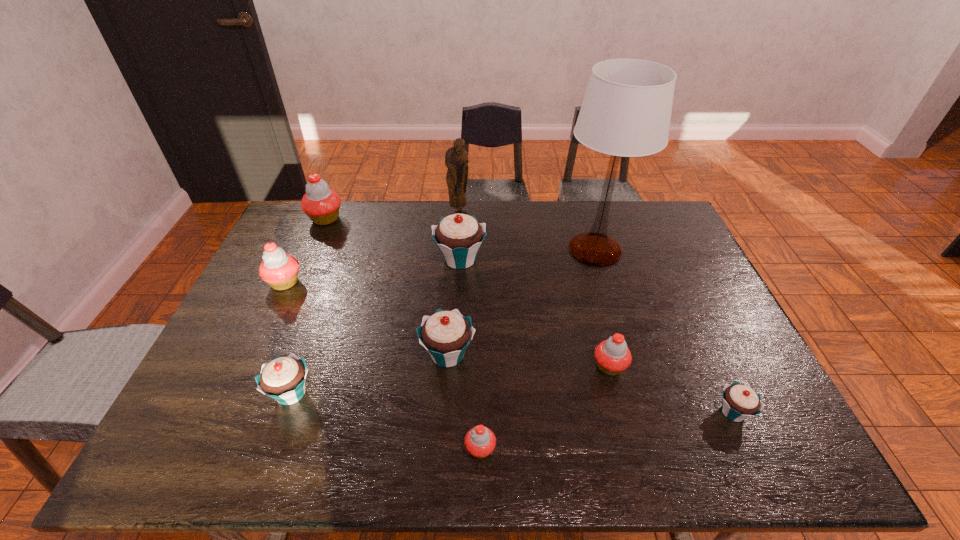
You are a GUI agent. You are given a task and a screenshot of the screen. Output one action in this format:
    pyautogui.click(x=<x>, y=<y>)
    Task: Click on the table lamp
    
    Given the screenshot: What is the action you would take?
    pyautogui.click(x=626, y=111)

This screenshot has height=540, width=960. I want to click on the ninth shortest object, so click(456, 160).

What are the coordinates of `the farthest teal cupcake` in the screenshot? It's located at (459, 236).

Find the location of a particular element. Image resolution: width=960 pixels, height=540 pixels. the farthest cupcake is located at coordinates (321, 204).

In order to click on the biggest red cupcake in this screenshot , I will do `click(321, 204)`.

You are a GUI agent. You are given a task and a screenshot of the screen. Output one action in this format:
    pyautogui.click(x=<x>, y=<y>)
    Task: Click on the second biggest red cupcake
    Image resolution: width=960 pixels, height=540 pixels.
    Given the screenshot: What is the action you would take?
    pyautogui.click(x=279, y=269)

This screenshot has width=960, height=540. I want to click on the third smallest teal cupcake, so (x=445, y=335).

Find the location of `the rightmost red cupcake`. the rightmost red cupcake is located at coordinates (613, 356).

The image size is (960, 540). Find the location of `the third farthest red cupcake`. the third farthest red cupcake is located at coordinates (613, 356).

Find the location of a particular element. The width and height of the screenshot is (960, 540). the third biggest teal cupcake is located at coordinates (283, 379).